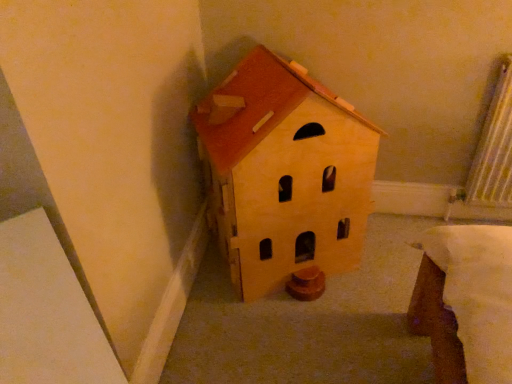
The width and height of the screenshot is (512, 384). Identify the location of vacant space in front of wooden house at center. (301, 342).